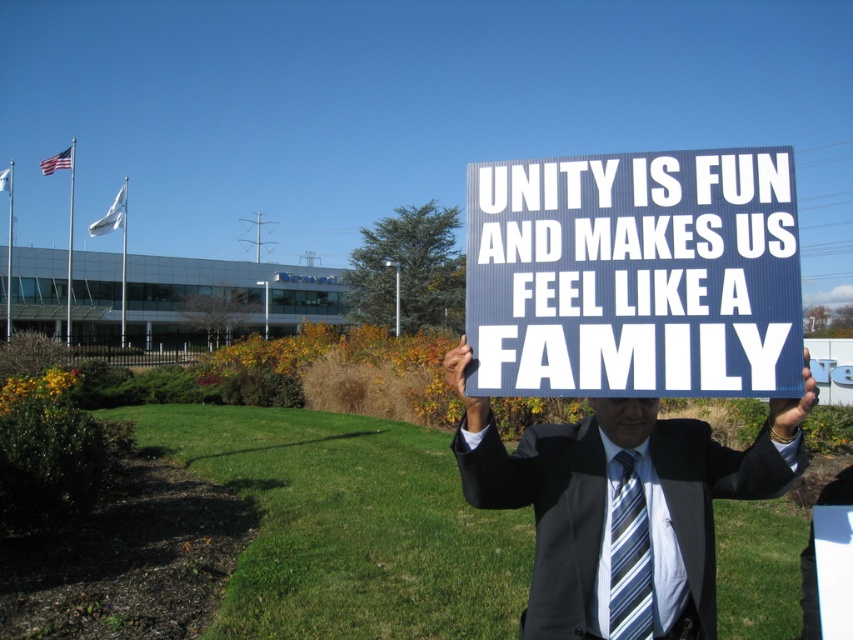
Question: Can you confirm if blue corrugated plastic sign at center is bigger than dark gray suit at center?

Choices:
 (A) no
 (B) yes

Answer: (A)

Question: From the image, what is the correct spatial relationship of blue corrugated plastic sign at center in relation to dark gray suit at center?

Choices:
 (A) above
 (B) below

Answer: (A)

Question: Which point is closer to the camera?

Choices:
 (A) dark gray suit at center
 (B) striped fabric tie at center

Answer: (A)

Question: Which is nearer to the dark gray suit at center?

Choices:
 (A) blue corrugated plastic sign at center
 (B) striped fabric tie at center

Answer: (B)

Question: Which point is closer to the camera?

Choices:
 (A) striped fabric tie at center
 (B) dark gray suit at center
 (C) blue corrugated plastic sign at center

Answer: (C)

Question: Does blue corrugated plastic sign at center lie in front of striped fabric tie at center?

Choices:
 (A) no
 (B) yes

Answer: (B)